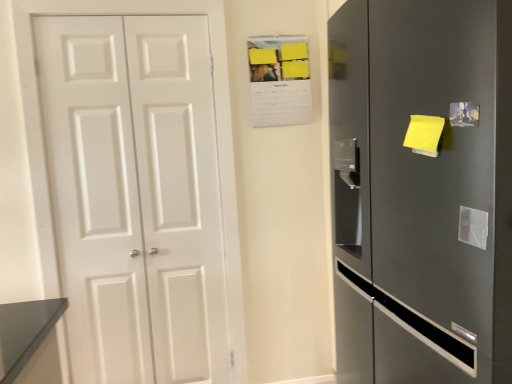
The height and width of the screenshot is (384, 512). In order to click on free point above white matte door at left (from a real-world perspective) in this screenshot , I will do `click(117, 1)`.